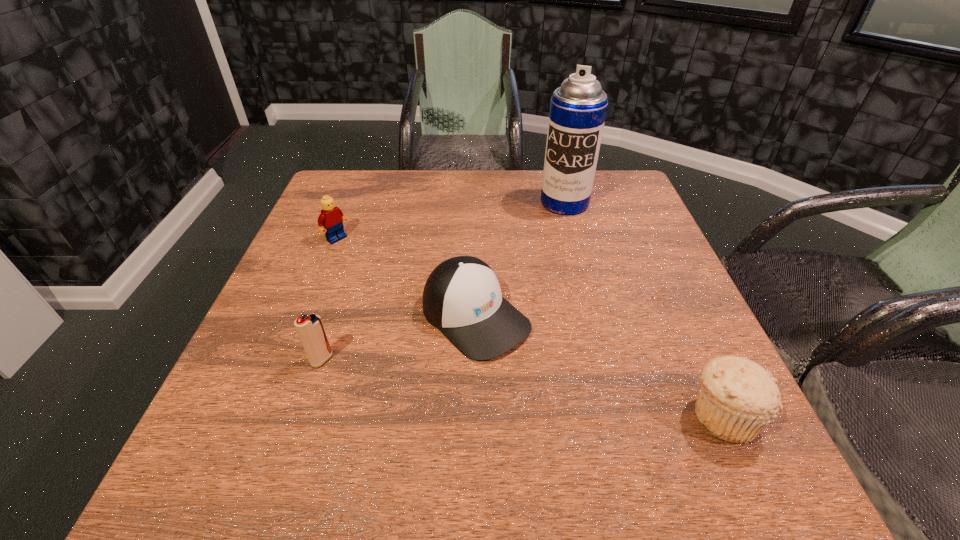
Where is `vacant space on the desktop that is between the second object from left to right and the nearest object and is positioned on the label side of the farthest object`? vacant space on the desktop that is between the second object from left to right and the nearest object and is positioned on the label side of the farthest object is located at coordinates (491, 383).

The height and width of the screenshot is (540, 960). Identify the location of free spot on the desktop that is between the igniter and the muffin and is positioned on the front-facing side of the leftmost object. (539, 389).

Locate an element on the screen. vacant spot on the desktop that is between the fourth object from right to left and the muffin and is positioned on the front panel of the cap is located at coordinates (562, 393).